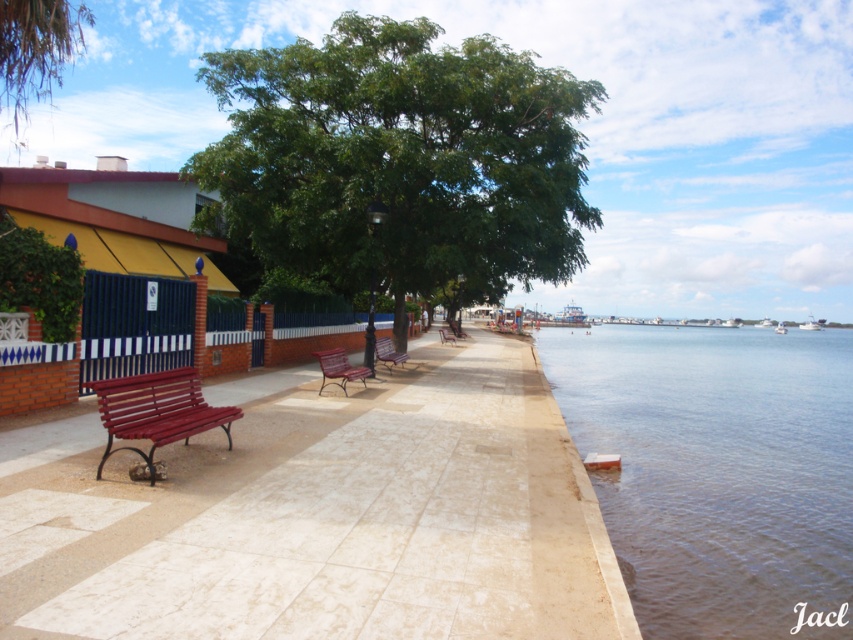
Question: Which of these objects is positioned farthest from the green leafy tree at upper center?

Choices:
 (A) matte red bench at left
 (B) wooden woven bench at center
 (C) white marble pavement at center
 (D) green leafy tree at center

Answer: (B)

Question: Which object appears farthest from the camera in this image?

Choices:
 (A) wooden woven bench at center
 (B) matte red bench at left
 (C) metallic polished bench at center

Answer: (C)

Question: In this image, where is matte red bench at left located relative to metallic red bench at center?

Choices:
 (A) above
 (B) below

Answer: (B)

Question: Is green leafy tree at center smaller than matte red bench at left?

Choices:
 (A) yes
 (B) no

Answer: (B)

Question: Considering the relative positions of white marble pavement at center and metallic red bench at center in the image provided, where is white marble pavement at center located with respect to metallic red bench at center?

Choices:
 (A) left
 (B) right

Answer: (A)

Question: Among these objects, which one is farthest from the camera?

Choices:
 (A) matte red bench at left
 (B) white marble pavement at center

Answer: (A)